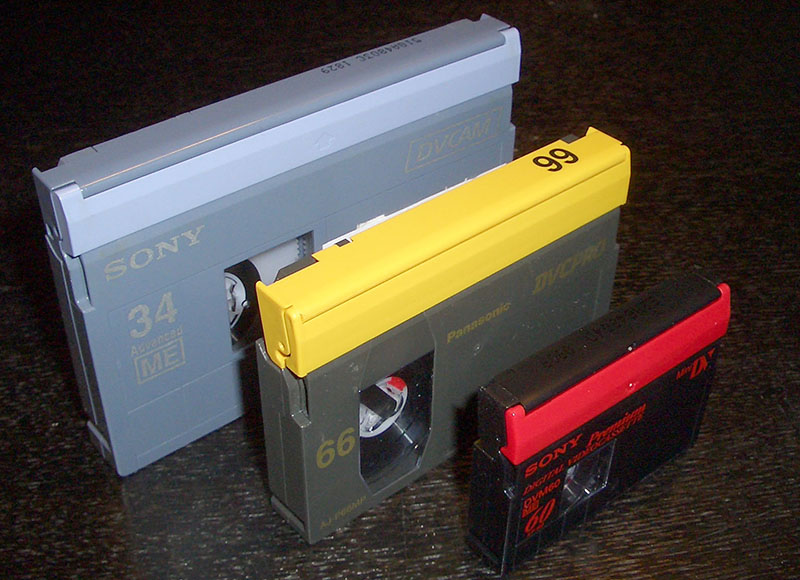
The image size is (800, 580). Identify the location of dark brown table. (730, 506).